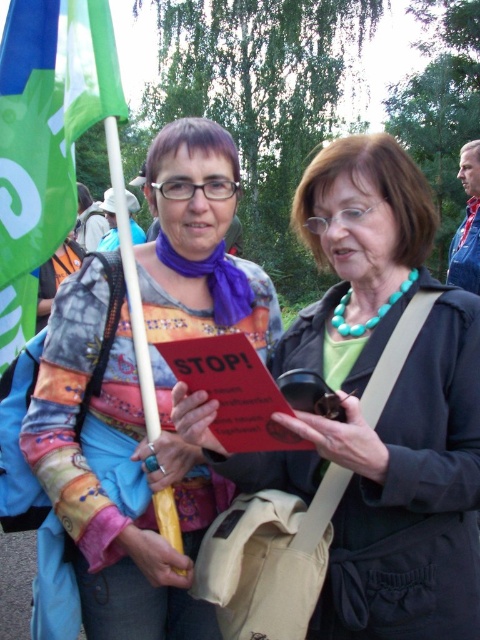
Question: Where is multicolored patchwork shirt at center located in relation to green fabric flag at left in the image?

Choices:
 (A) left
 (B) right

Answer: (B)

Question: Which of the following is the farthest from the observer?

Choices:
 (A) (167, 337)
 (B) (62, 8)

Answer: (A)

Question: Does multicolored patchwork shirt at center lie behind green fabric flag at left?

Choices:
 (A) yes
 (B) no

Answer: (A)

Question: Can you confirm if multicolored patchwork shirt at center is positioned below green fabric flag at left?

Choices:
 (A) no
 (B) yes

Answer: (B)

Question: Based on their relative distances, which object is nearer to the multicolored patchwork shirt at center?

Choices:
 (A) matte black jacket at center
 (B) green fabric flag at left

Answer: (A)

Question: Which of these objects is positioned farthest from the multicolored patchwork shirt at center?

Choices:
 (A) green fabric flag at left
 (B) matte black jacket at center

Answer: (A)